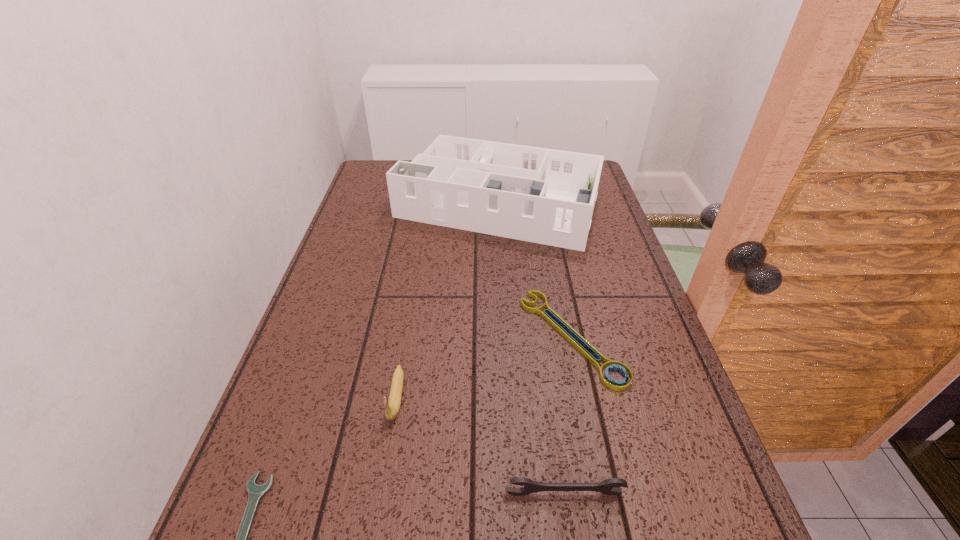
Identify the location of blank region between the second shortest wrench and the tallest object. (535, 273).

Locate an element on the screen. This screenshot has width=960, height=540. empty space between the farthest wrench and the tallest wrench is located at coordinates (568, 415).

Find the location of a particular element. empty space that is in between the third shortest object and the tallest object is located at coordinates (531, 350).

The image size is (960, 540). What are the coordinates of `the third closest object to the tallest object` in the screenshot? It's located at tap(256, 492).

Find the location of a particular element. The image size is (960, 540). the closest object to the second tallest object is located at coordinates (256, 492).

Where is `wrench identified as the second closest to the fourth tallest object`? The width and height of the screenshot is (960, 540). wrench identified as the second closest to the fourth tallest object is located at coordinates (256, 492).

Identify which wrench is the second nearest to the fourth tallest object. Please provide its 2D coordinates. Your answer should be formatted as a tuple, i.e. [(x, y)], where the tuple contains the x and y coordinates of a point satisfying the conditions above.

[(256, 492)]